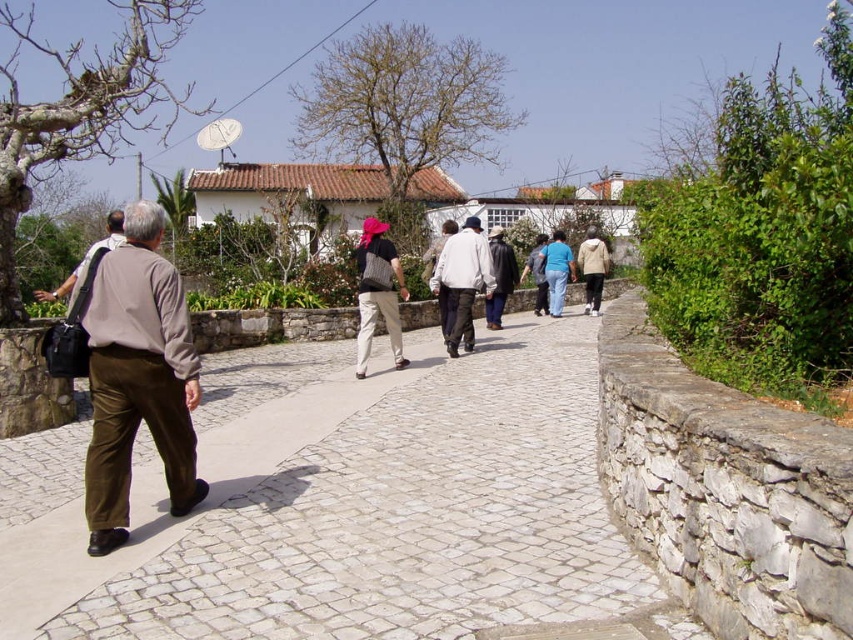
Question: Which point is farther to the camera?

Choices:
 (A) light gray fabric jacket at center
 (B) blue cotton shirt at center
 (C) beige fabric jacket at center
 (D) brown corduroy pants at left

Answer: (C)

Question: Among these points, which one is nearest to the camera?

Choices:
 (A) (363, 314)
 (B) (505, 296)
 (C) (599, 276)

Answer: (A)

Question: In this image, where is matte black backpack at center located relative to blue cotton shirt at center?

Choices:
 (A) right
 (B) left

Answer: (B)

Question: Which object is the closest to the brown corduroy pants at left?

Choices:
 (A) matte black backpack at center
 (B) white stone pavement at center
 (C) blue cotton shirt at center

Answer: (B)

Question: Is brown corduroy pants at left further to the viewer compared to blue cotton shirt at center?

Choices:
 (A) no
 (B) yes

Answer: (A)

Question: Does white stone pavement at center appear on the right side of brown corduroy pants at left?

Choices:
 (A) yes
 (B) no

Answer: (A)